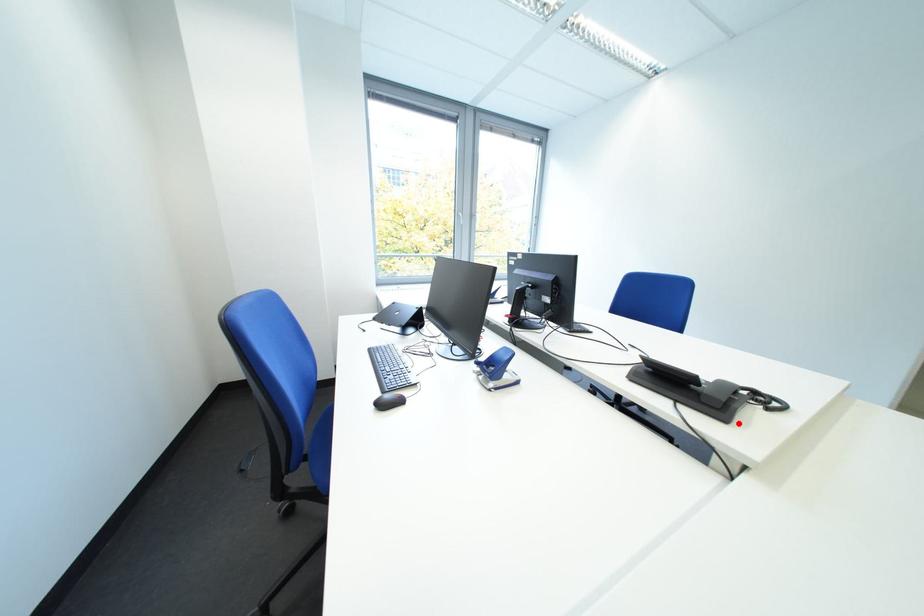
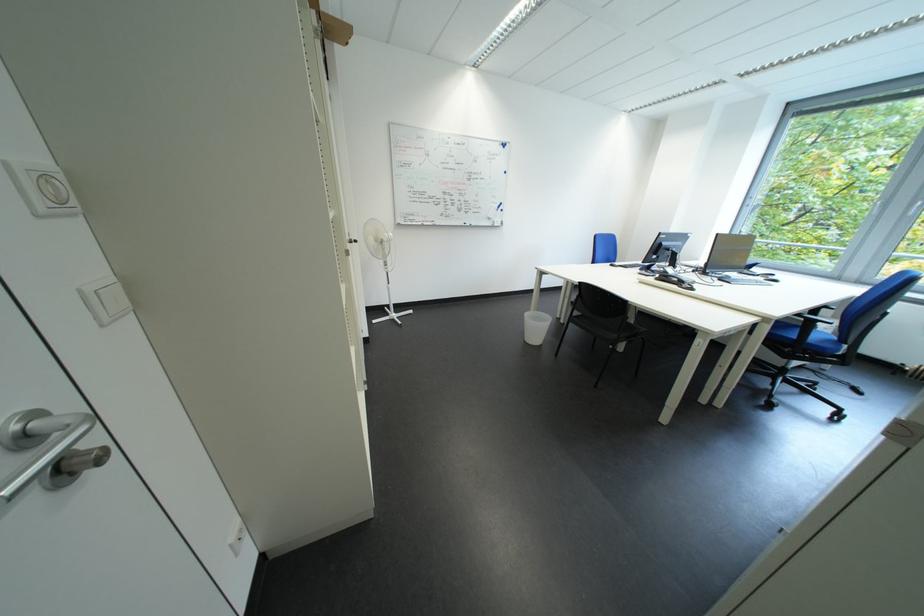
Where in the second image is the point corresponding to the highlighted location from the first image?

(669, 282)